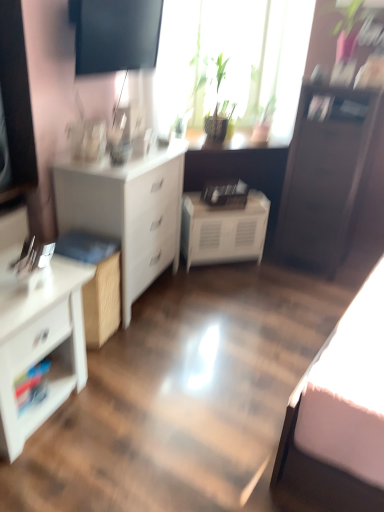
Question: Is white matte chest of drawers at left, which is counted as the first chest of drawers, starting from the back, situated inside white glossy chest of drawers at left, the 2th chest of drawers positioned from the back, or outside?

Choices:
 (A) inside
 (B) outside

Answer: (B)

Question: In the image, is white matte chest of drawers at left, which is counted as the first chest of drawers, starting from the back, positioned in front of or behind white glossy chest of drawers at left, acting as the first chest of drawers starting from the front?

Choices:
 (A) front
 (B) behind

Answer: (B)

Question: Based on their relative distances, which object is nearer to the white glossy shelf at lower left?

Choices:
 (A) white matte chest of drawers at left, the second chest of drawers in the front-to-back sequence
 (B) green leafy plant at upper center
 (C) white matte cabinet at center
 (D) dark wood file cabinet at right
 (E) white glossy chest of drawers at left, the 2th chest of drawers positioned from the back

Answer: (E)

Question: Estimate the real-world distances between objects in this image. Which object is farther from the white glossy chest of drawers at left, acting as the first chest of drawers starting from the front?

Choices:
 (A) white matte chest of drawers at left, which is counted as the first chest of drawers, starting from the back
 (B) green leafy plant at upper center
 (C) dark wood file cabinet at right
 (D) white matte cabinet at center
 (E) white glossy shelf at lower left

Answer: (B)